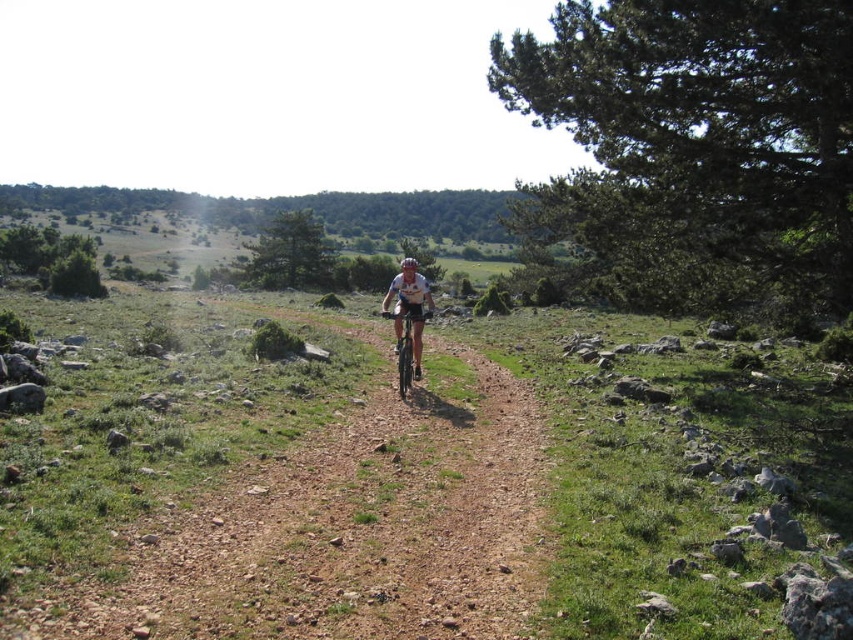
You are a photographer aiming to capture the cyclist in the scene. Given the presence of the shiny metallic bicycle at center and the white matte bicycle helmet at center, which object would appear taller in the photo?

The white matte bicycle helmet at center appears taller than the shiny metallic bicycle at center in the photo.